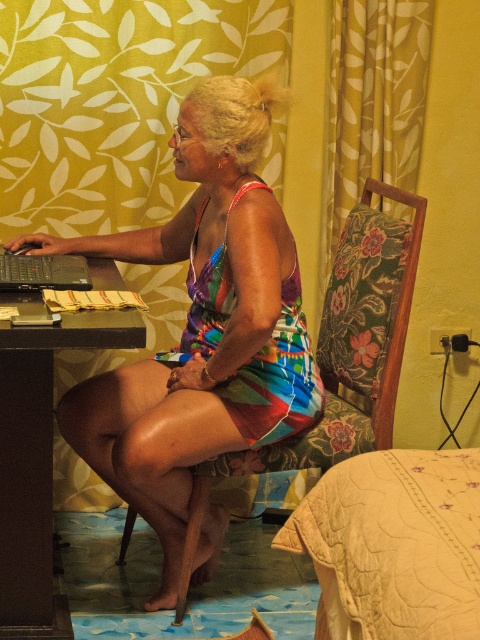
Can you confirm if beige quilted bed at lower right is positioned above black plastic table at left?

No, beige quilted bed at lower right is not above black plastic table at left.

Who is more forward, (345, 637) or (9, 392)?

Point (345, 637)

Where is `beige quilted bed at lower right`? The width and height of the screenshot is (480, 640). beige quilted bed at lower right is located at coordinates (394, 545).

I want to click on beige quilted bed at lower right, so click(394, 545).

Who is lower down, multicolored printed dress at center or black matte laptop at left?

multicolored printed dress at center

Locate an element on the screen. The height and width of the screenshot is (640, 480). multicolored printed dress at center is located at coordinates (276, 378).

Is point (271, 435) behind point (39, 276)?

No, it is not.

Image resolution: width=480 pixels, height=640 pixels. In order to click on multicolored printed dress at center in this screenshot , I will do (276, 378).

Is multicolored fabric dress at center thinner than black matte laptop at left?

Incorrect, multicolored fabric dress at center's width is not less than black matte laptop at left's.

Who is taller, multicolored fabric dress at center or black matte laptop at left?

multicolored fabric dress at center is taller.

The image size is (480, 640). What do you see at coordinates (202, 324) in the screenshot? I see `multicolored fabric dress at center` at bounding box center [202, 324].

This screenshot has height=640, width=480. Find the location of `multicolored fabric dress at center`. multicolored fabric dress at center is located at coordinates (202, 324).